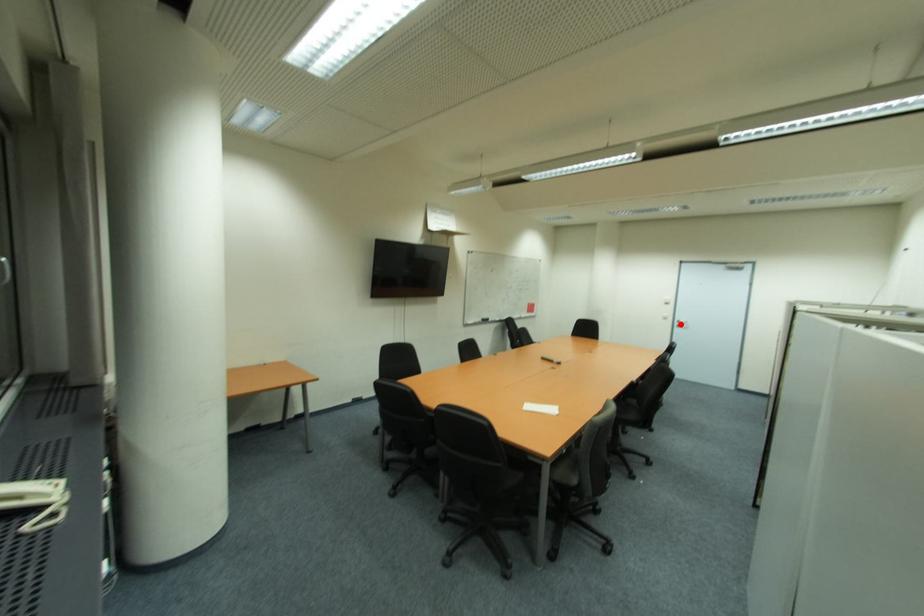
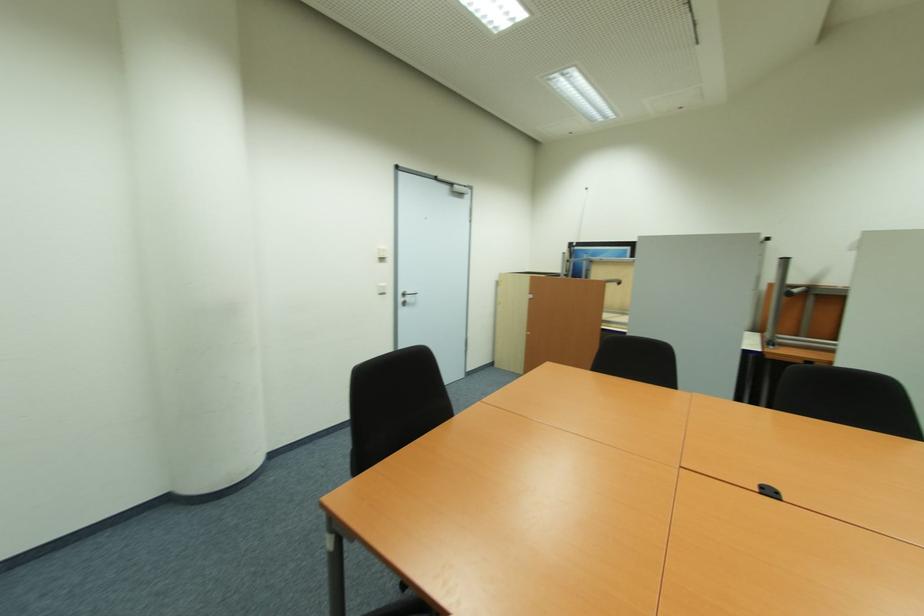
Question: I am providing you with two images of the same scene from different viewpoints. Given a red point in image1, look at the same physical point in image2. Is it:

Choices:
 (A) Closer to the viewpoint
 (B) Farther from the viewpoint

Answer: (A)